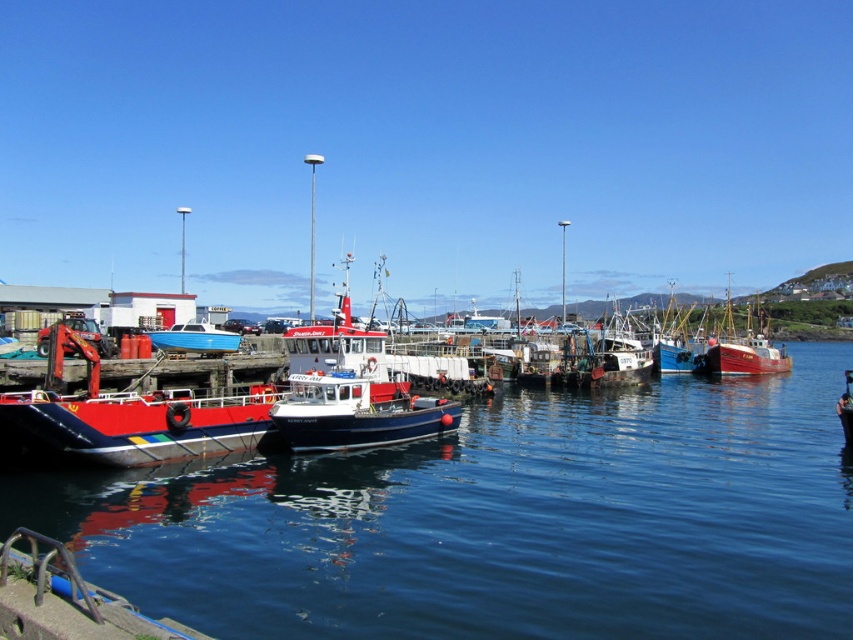
You are a dock worker who needs to load a container that requires a boat with a minimum width of 10 meters. You have two options available at the center of the pier, the white glossy boat at center and the red wooden boat at center. Which boat should you choose?

The red wooden boat at center has a greater width than the white glossy boat at center, so you should choose the red wooden boat at center to load the container since it meets the minimum width requirement of 10 meters.

You are standing at the edge of the wooden pier looking out at the boats in the harbor. There are two points marked on the image at coordinates point (672, 336) and point (192, 339). Which of these points is closer to your viewpoint?

Point (672, 336) is further to the camera than point (192, 339), so the point closer to your viewpoint is point (192, 339).